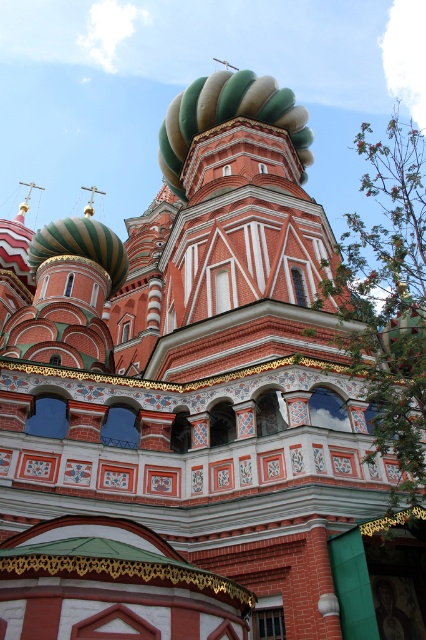
You are standing in front of the grand architectural structure and want to take a photo. There are two points of interest marked as point 1 at coordinates point (282,124) and point 2 at coordinates point (46,257). Which point is closer to your camera lens when taking the photo?

Point (282,124) is further to the camera than point (46,257), so the point closer to the camera lens is point (46,257).

You are an architect examining the cathedral. Which of the two domes, the green glossy onion dome at center or the green striped dome at upper left, has a greater height?

The green glossy onion dome at center is taller than the green striped dome at upper left.

You are an architect examining this Russian Orthodox structure. You notice the green glossy onion dome at center and the green striped dome at upper left. Which of these two domes is positioned to the right of the other?

The green glossy onion dome at center is positioned to the right of the green striped dome at upper left.